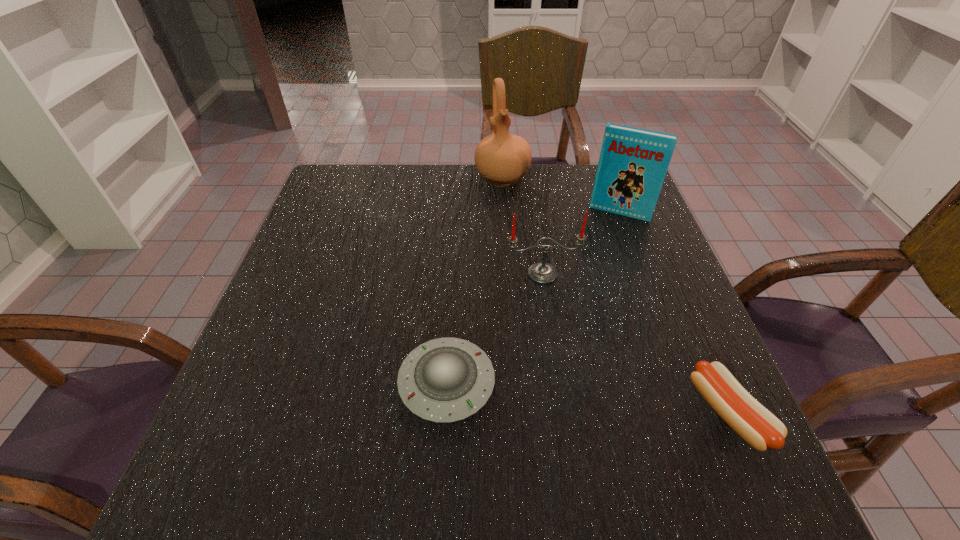
Locate an element on the screen. The width and height of the screenshot is (960, 540). free region that satisfies the following two spatial constraints: 1. on the front side of the second farthest object; 2. on the right side of the sausage is located at coordinates (694, 413).

Find the location of a particular element. vacant position in the image that satisfies the following two spatial constraints: 1. on the back side of the third nearest object; 2. on the right side of the fourth nearest object is located at coordinates (534, 213).